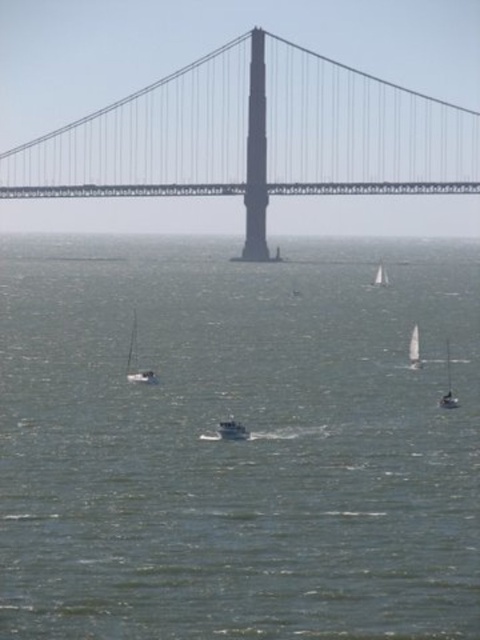
Which is in front, point (168, 337) or point (382, 275)?

Point (168, 337)

Between greenish-blue water at center and white sailboat at center, which one is positioned higher?

white sailboat at center

Where is `greenish-blue water at center`? The width and height of the screenshot is (480, 640). greenish-blue water at center is located at coordinates tap(238, 442).

Is metallic gray suspension bridge at center thinner than white sailboat at right?

Incorrect, metallic gray suspension bridge at center's width is not less than white sailboat at right's.

The width and height of the screenshot is (480, 640). I want to click on metallic gray suspension bridge at center, so click(255, 138).

Which is behind, point (132, 353) or point (456, 406)?

Positioned behind is point (132, 353).

Is white matte sailboat at left to the right of white matte sailboat at right from the viewer's perspective?

In fact, white matte sailboat at left is to the left of white matte sailboat at right.

Which is behind, point (134, 314) or point (445, 340)?

Positioned behind is point (134, 314).

You are a GUI agent. You are given a task and a screenshot of the screen. Output one action in this format:
    pyautogui.click(x=<x>, y=<y>)
    Task: Click on the white matte sailboat at left
    Image resolution: width=480 pixels, height=640 pixels.
    Given the screenshot: What is the action you would take?
    pyautogui.click(x=135, y=358)